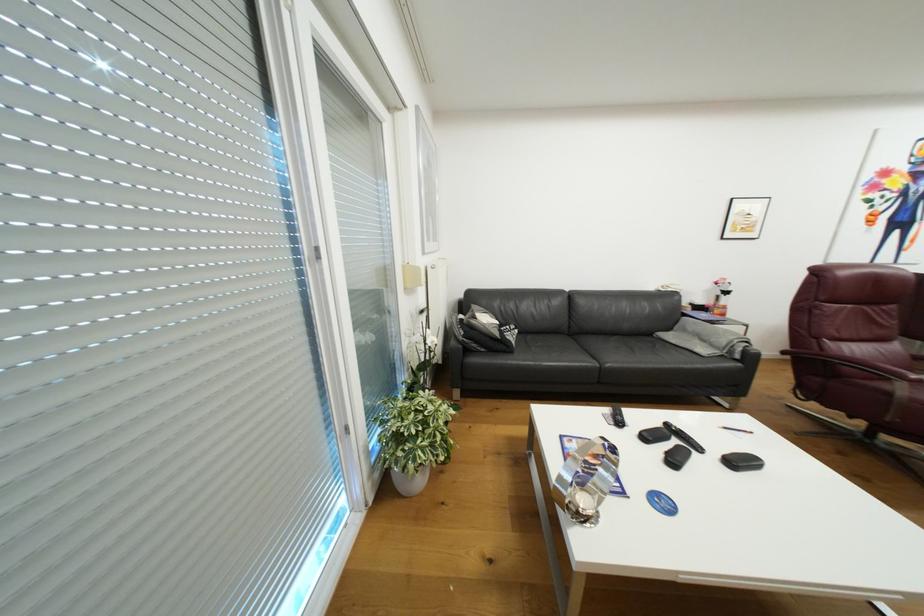
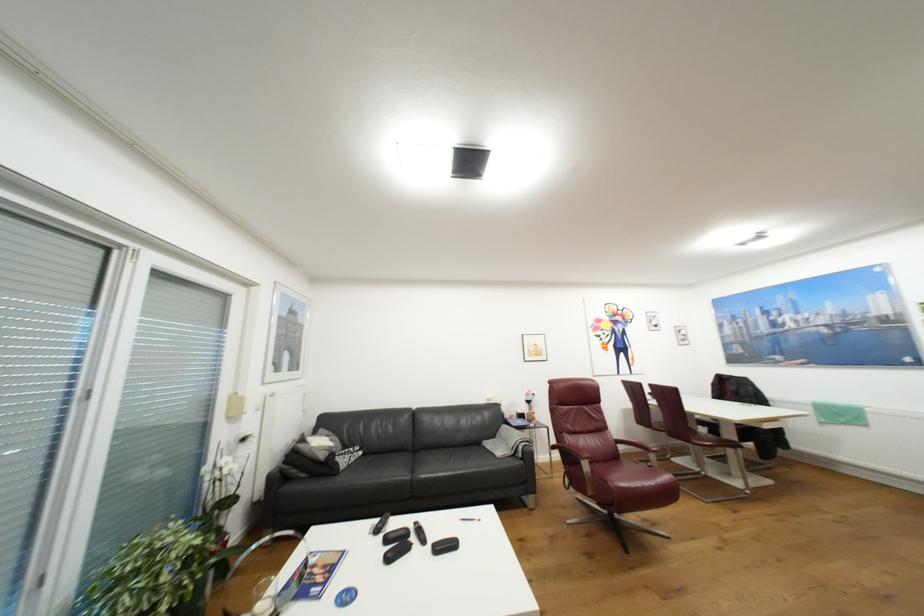
Find the pixel in the second image that matches pixel 669 503 in the first image.

(354, 597)